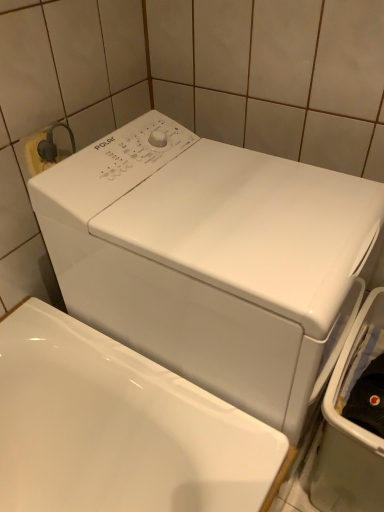
Question: Is white glossy dishwasher at right spatially inside white glossy washing machine at center, or outside of it?

Choices:
 (A) inside
 (B) outside

Answer: (B)

Question: Visually, is white glossy dishwasher at right positioned to the left or to the right of white glossy washing machine at center?

Choices:
 (A) left
 (B) right

Answer: (B)

Question: From a real-world perspective, is white glossy dishwasher at right positioned above or below white glossy washing machine at center?

Choices:
 (A) below
 (B) above

Answer: (A)

Question: In terms of width, does white glossy washing machine at center look wider or thinner when compared to white glossy dishwasher at right?

Choices:
 (A) thin
 (B) wide

Answer: (B)

Question: Considering the positions of white glossy washing machine at center and white glossy dishwasher at right in the image, is white glossy washing machine at center taller or shorter than white glossy dishwasher at right?

Choices:
 (A) short
 (B) tall

Answer: (B)

Question: From a real-world perspective, relative to white glossy dishwasher at right, is white glossy washing machine at center vertically above or below?

Choices:
 (A) below
 (B) above

Answer: (B)

Question: In terms of size, does white glossy washing machine at center appear bigger or smaller than white glossy dishwasher at right?

Choices:
 (A) big
 (B) small

Answer: (A)